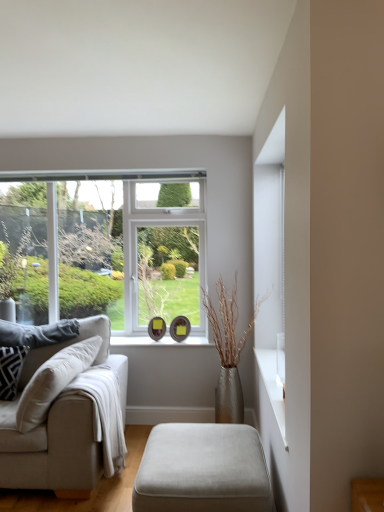
Question: Is beige fabric couch at left to the left of suede ottoman at lower center from the viewer's perspective?

Choices:
 (A) yes
 (B) no

Answer: (A)

Question: Is beige fabric couch at left aimed at suede ottoman at lower center?

Choices:
 (A) no
 (B) yes

Answer: (A)

Question: From the image's perspective, is beige fabric couch at left on suede ottoman at lower center?

Choices:
 (A) yes
 (B) no

Answer: (A)

Question: From the image's perspective, is beige fabric couch at left under suede ottoman at lower center?

Choices:
 (A) no
 (B) yes

Answer: (A)

Question: Is beige fabric couch at left wider than suede ottoman at lower center?

Choices:
 (A) yes
 (B) no

Answer: (A)

Question: Is beige fabric couch at left inside or outside of gray fabric pillow at left, which is the 1th pillow in back-to-front order?

Choices:
 (A) inside
 (B) outside

Answer: (B)

Question: Considering the positions of point (96, 426) and point (1, 326), is point (96, 426) closer or farther from the camera than point (1, 326)?

Choices:
 (A) closer
 (B) farther

Answer: (A)

Question: Is beige fabric couch at left to the left or to the right of gray fabric pillow at left, which is the 1th pillow in back-to-front order, in the image?

Choices:
 (A) right
 (B) left

Answer: (A)

Question: Looking at the image, does beige fabric couch at left seem bigger or smaller compared to gray fabric pillow at left, which is the 1th pillow in back-to-front order?

Choices:
 (A) small
 (B) big

Answer: (B)

Question: From a real-world perspective, relative to gray fabric pillow at left, which is the 1th pillow in back-to-front order, is white plastic window at center vertically above or below?

Choices:
 (A) above
 (B) below

Answer: (A)

Question: Relative to gray fabric pillow at left, the 2th pillow in the front-to-back sequence, is white plastic window at center in front or behind?

Choices:
 (A) front
 (B) behind

Answer: (B)

Question: Considering the positions of point 178,293 and point 6,344, is point 178,293 closer or farther from the camera than point 6,344?

Choices:
 (A) closer
 (B) farther

Answer: (B)

Question: Do you think white plastic window at center is within gray fabric pillow at left, the 2th pillow in the front-to-back sequence, or outside of it?

Choices:
 (A) outside
 (B) inside

Answer: (A)

Question: Considering the positions of patterned fabric pillow on the left, the first pillow viewed from the front, and beige fabric couch at left in the image, is patterned fabric pillow on the left, the first pillow viewed from the front, wider or thinner than beige fabric couch at left?

Choices:
 (A) thin
 (B) wide

Answer: (A)

Question: Considering the relative positions of patterned fabric pillow on the left, the first pillow viewed from the front, and beige fabric couch at left in the image provided, is patterned fabric pillow on the left, the first pillow viewed from the front, to the left or to the right of beige fabric couch at left?

Choices:
 (A) right
 (B) left

Answer: (B)